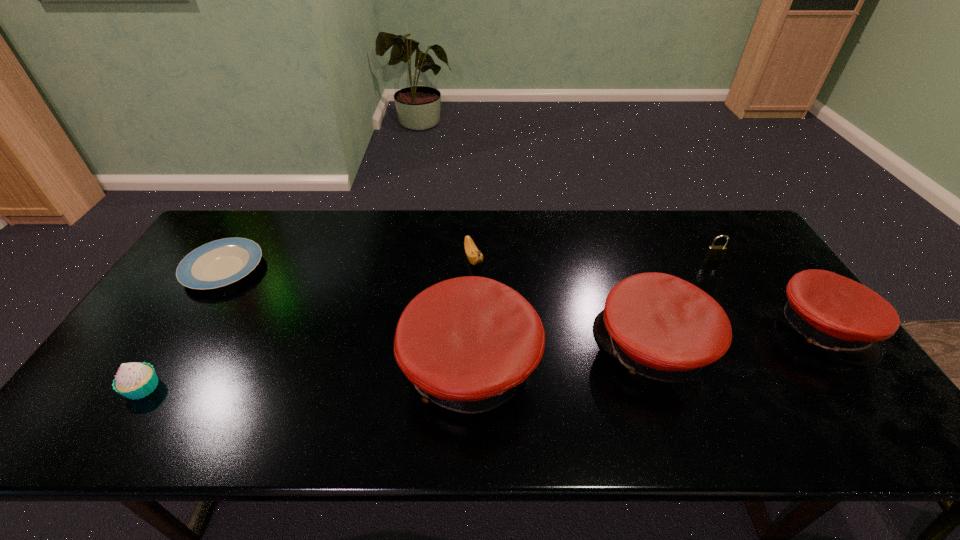
I want to click on banana that is at the far edge, so click(x=475, y=257).

Image resolution: width=960 pixels, height=540 pixels. I want to click on cupcake present at the near edge, so click(135, 380).

At what (x,y) coordinates should I click in order to perform the action: click on plate situated at the left edge. Please return your answer as a coordinate pair (x, y). Looking at the image, I should click on (221, 262).

The height and width of the screenshot is (540, 960). I want to click on cupcake that is at the left edge, so click(135, 380).

Where is `cap that is at the right edge`? cap that is at the right edge is located at coordinates (847, 319).

Locate an element on the screen. The height and width of the screenshot is (540, 960). padlock at the right edge is located at coordinates [713, 252].

This screenshot has width=960, height=540. I want to click on object located in the far left corner section of the desktop, so click(x=221, y=262).

The width and height of the screenshot is (960, 540). Find the location of `object present at the near left corner`. object present at the near left corner is located at coordinates (135, 380).

Image resolution: width=960 pixels, height=540 pixels. In the image, there is a desktop. What are the coordinates of `blank space at the far edge` in the screenshot? It's located at (324, 224).

The height and width of the screenshot is (540, 960). In the image, there is a desktop. Identify the location of free space at the near edge. (604, 394).